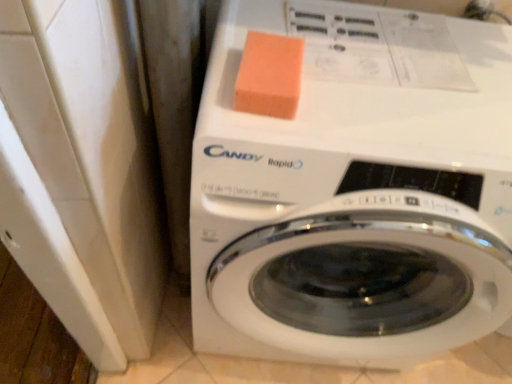
The image size is (512, 384). Identify the location of vacant space in front of orange sponge at upper center. (263, 130).